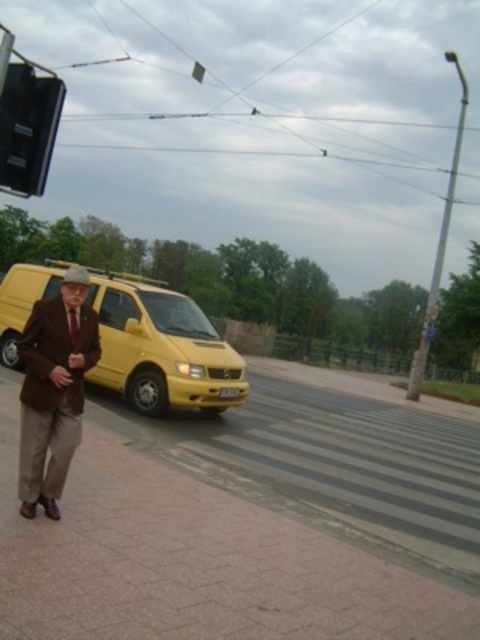
Which is behind, point (134, 372) or point (60, 442)?

Positioned behind is point (134, 372).

Is yellow matte van at left taller than brown woolen suit at left?

Indeed, yellow matte van at left has a greater height compared to brown woolen suit at left.

The height and width of the screenshot is (640, 480). What do you see at coordinates (160, 348) in the screenshot?
I see `yellow matte van at left` at bounding box center [160, 348].

The width and height of the screenshot is (480, 640). In order to click on yellow matte van at left in this screenshot , I will do `click(160, 348)`.

Who is more forward, (206, 380) or (24, 88)?

Positioned in front is point (24, 88).

Identify the location of yellow matte van at left. (160, 348).

What are the coordinates of `yellow matte van at left` in the screenshot? It's located at (160, 348).

Does brown brick pavement at lower left have a lesser width compared to black plastic traffic light at upper left?

No, brown brick pavement at lower left is not thinner than black plastic traffic light at upper left.

Measure the distance between brown brick pavement at lower left and black plastic traffic light at upper left.

5.03 meters

Is point (396, 461) positioned in front of point (21, 188)?

That is False.

Find the location of a particular element. brown brick pavement at lower left is located at coordinates (253, 518).